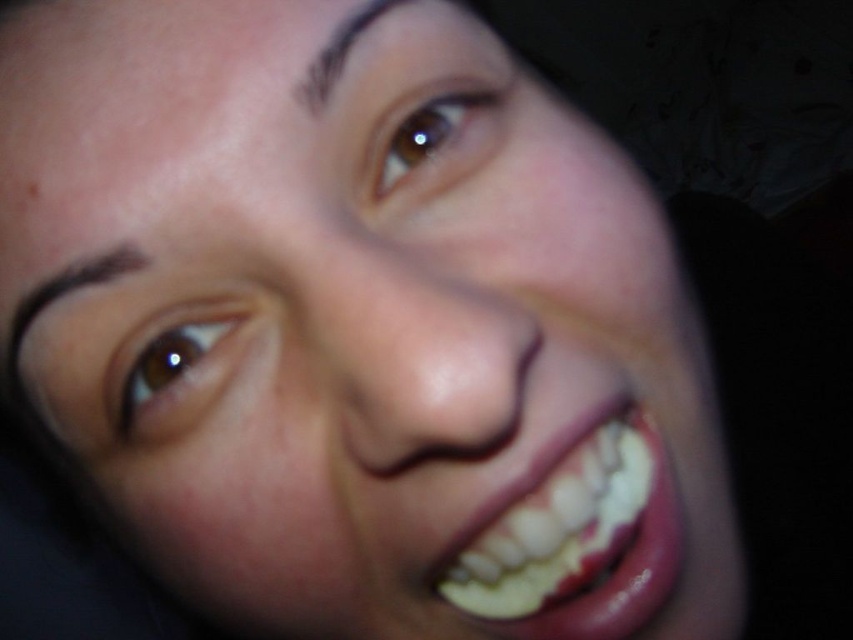
You are a photographer adjusting the lighting for a portrait. You notice the brown matte eye at upper left and the brown shiny eye at upper center. Which eye is positioned lower in the face?

The brown matte eye at upper left is positioned lower than the brown shiny eye at upper center because it is located below it.